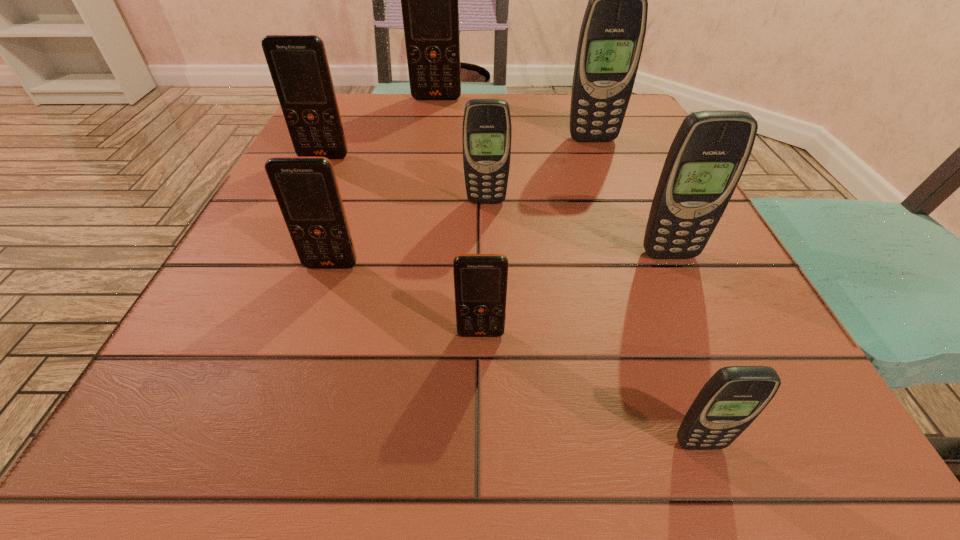
You are a GUI agent. You are given a task and a screenshot of the screen. Output one action in this format:
    pyautogui.click(x=<x>, y=<y>)
    Task: Click on the third orange cellular telephone from left to right
    
    Given the screenshot: What is the action you would take?
    pyautogui.click(x=429, y=0)

Where is `the third cellular telephone from left to right`? The image size is (960, 540). the third cellular telephone from left to right is located at coordinates (429, 0).

The height and width of the screenshot is (540, 960). Find the location of `the second farthest cellular telephone`. the second farthest cellular telephone is located at coordinates (612, 34).

Identify the location of the seventh nearest object. This screenshot has width=960, height=540. (612, 34).

I want to click on the second biggest orange cellular telephone, so click(x=298, y=64).

Where is `the third farthest object`? the third farthest object is located at coordinates (298, 64).

Find the location of a particular element. the third smallest gray cellular telephone is located at coordinates (709, 153).

Where is `the second nearest gray cellular telephone`? The image size is (960, 540). the second nearest gray cellular telephone is located at coordinates (709, 153).

Where is `the fourth farthest cellular telephone`? This screenshot has height=540, width=960. the fourth farthest cellular telephone is located at coordinates (487, 130).

The image size is (960, 540). Identify the location of the leftmost gray cellular telephone. (487, 130).